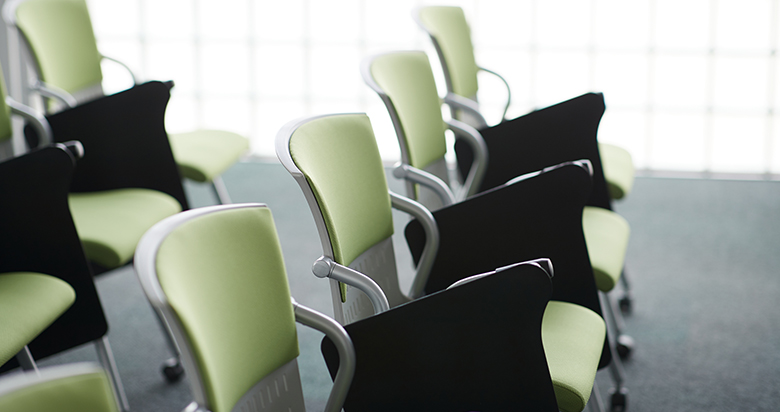
Locate an element on the screen. Image resolution: width=780 pixels, height=412 pixels. green chair with black arm rests is located at coordinates (463, 64), (402, 97), (337, 196), (250, 281), (66, 387), (44, 308), (94, 233), (190, 156).